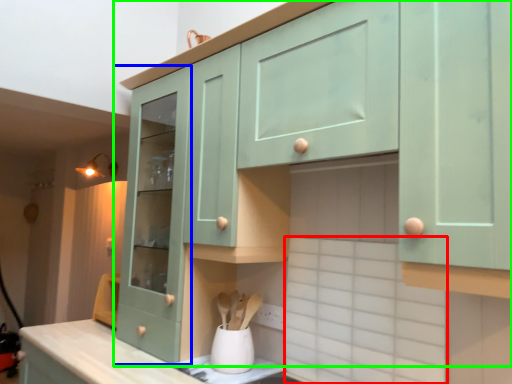
Question: Estimate the real-world distances between objects in this image. Which object is farther from ceramic tile (highlighted by a red box), cabinetry (highlighted by a blue box) or cabinetry (highlighted by a green box)?

Choices:
 (A) cabinetry
 (B) cabinetry

Answer: (A)